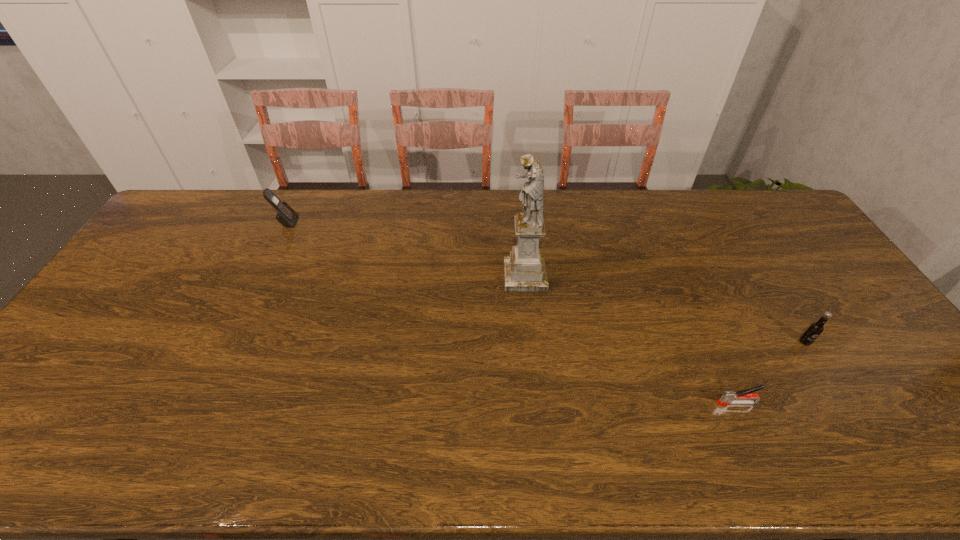
This screenshot has height=540, width=960. What are the coordinates of `vacant region between the shortest object and the root beer` in the screenshot? It's located at (771, 373).

The image size is (960, 540). In order to click on free area in between the root beer and the shortest object in this screenshot , I will do `click(771, 373)`.

Identify which object is the closest to the sculpture. Please provide its 2D coordinates. Your answer should be formatted as a tuple, i.e. [(x, y)], where the tuple contains the x and y coordinates of a point satisfying the conditions above.

[(728, 397)]

The height and width of the screenshot is (540, 960). Find the location of `the closest object to the second farthest object`. the closest object to the second farthest object is located at coordinates (728, 397).

Find the location of a particular element. The width and height of the screenshot is (960, 540). vacant space that satisfies the following two spatial constraints: 1. on the label of the rightmost object; 2. on the handle side of the stapler is located at coordinates (843, 403).

Identify the location of free point that satisfies the following two spatial constraints: 1. on the label of the rightmost object; 2. on the handle side of the nearest object. This screenshot has height=540, width=960. (843, 403).

At what (x,y) coordinates should I click in order to perform the action: click on vacant region that satisfies the following two spatial constraints: 1. on the label of the root beer; 2. on the handle side of the nearest object. Please return your answer as a coordinate pair (x, y). Image resolution: width=960 pixels, height=540 pixels. Looking at the image, I should click on (x=843, y=403).